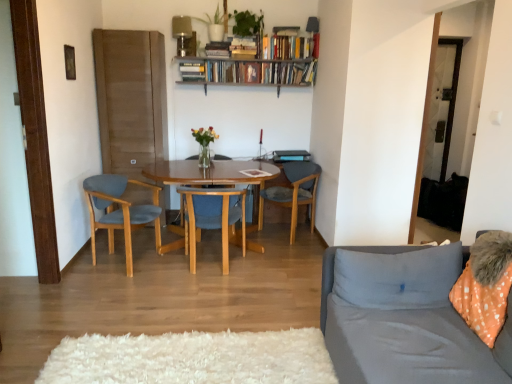
Question: Considering the relative sizes of hardcover books at upper center, which appears as the 1th book when viewed from the right, and gray fabric couch at right in the image provided, is hardcover books at upper center, which appears as the 1th book when viewed from the right, smaller than gray fabric couch at right?

Choices:
 (A) yes
 (B) no

Answer: (A)

Question: From the image's perspective, is hardcover books at upper center, which appears as the 1th book when viewed from the right, located beneath gray fabric couch at right?

Choices:
 (A) yes
 (B) no

Answer: (B)

Question: Is hardcover books at upper center, the 3th book when ordered from left to right, positioned in front of gray fabric couch at right?

Choices:
 (A) yes
 (B) no

Answer: (B)

Question: Are hardcover books at upper center, the 3th book when ordered from left to right, and gray fabric couch at right making contact?

Choices:
 (A) yes
 (B) no

Answer: (B)

Question: Is the position of hardcover books at upper center, which appears as the 1th book when viewed from the right, more distant than that of gray fabric couch at right?

Choices:
 (A) no
 (B) yes

Answer: (B)

Question: From a real-world perspective, is hardcover book at upper center, which is the first book in left-to-right order, above or below gray fabric pillow at right?

Choices:
 (A) above
 (B) below

Answer: (A)

Question: Considering the positions of hardcover book at upper center, which is the third book from right to left, and gray fabric pillow at right in the image, is hardcover book at upper center, which is the third book from right to left, taller or shorter than gray fabric pillow at right?

Choices:
 (A) tall
 (B) short

Answer: (B)

Question: From the image's perspective, is hardcover book at upper center, which is the first book in left-to-right order, located above or below gray fabric pillow at right?

Choices:
 (A) below
 (B) above

Answer: (B)

Question: Would you say hardcover book at upper center, which is the third book from right to left, is inside or outside gray fabric pillow at right?

Choices:
 (A) inside
 (B) outside

Answer: (B)

Question: From a real-world perspective, is metallic silver lamp at upper center, positioned as the first lamp in left-to-right order, physically located above or below green matte plant at upper center, which ranks as the second houseplant in right-to-left order?

Choices:
 (A) above
 (B) below

Answer: (B)

Question: From the image's perspective, relative to green matte plant at upper center, which ranks as the second houseplant in right-to-left order, is metallic silver lamp at upper center, which is the 2th lamp from right to left, above or below?

Choices:
 (A) above
 (B) below

Answer: (B)

Question: Which is correct: metallic silver lamp at upper center, which is the 2th lamp from right to left, is inside green matte plant at upper center, which ranks as the second houseplant in right-to-left order, or outside of it?

Choices:
 (A) outside
 (B) inside

Answer: (A)

Question: Is metallic silver lamp at upper center, positioned as the first lamp in left-to-right order, bigger or smaller than green matte plant at upper center, the first houseplant in the left-to-right sequence?

Choices:
 (A) small
 (B) big

Answer: (A)

Question: Considering the positions of hardcover book at upper center, which is the third book from right to left, and hardcover books at upper center, the 3th book when ordered from left to right, in the image, is hardcover book at upper center, which is the third book from right to left, wider or thinner than hardcover books at upper center, the 3th book when ordered from left to right,?

Choices:
 (A) wide
 (B) thin

Answer: (A)

Question: Looking at the image, does hardcover book at upper center, which is the first book in left-to-right order, seem bigger or smaller compared to hardcover books at upper center, which appears as the 1th book when viewed from the right?

Choices:
 (A) big
 (B) small

Answer: (B)